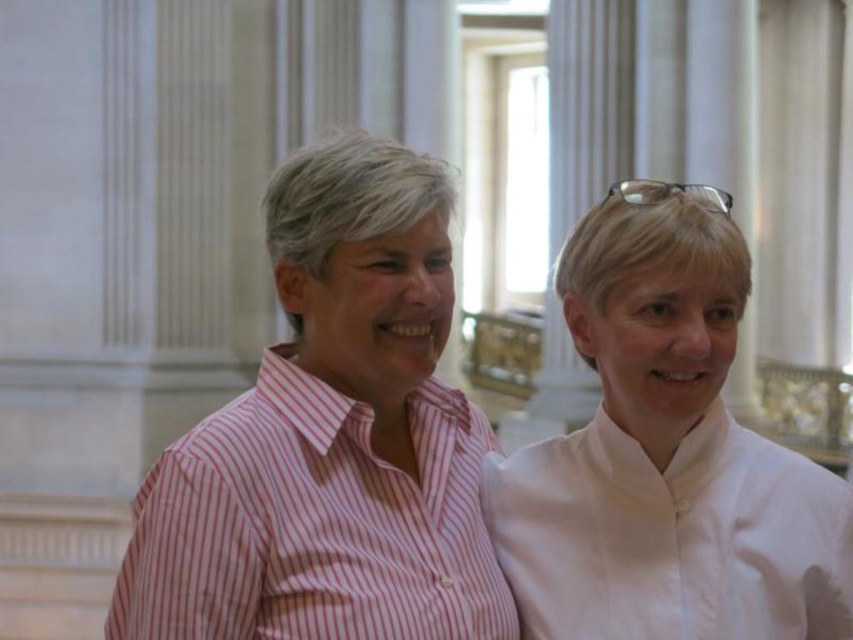
You are a photographer standing 10 feet away from the two people wearing pink striped shirts. You want to take a photo of both of them in the same frame. Given that your camera has a maximum focus range of 10 feet, will both the pink striped shirt at center and the pink striped shirt at left be in focus?

Both the pink striped shirt at center and the pink striped shirt at left are within the 10 feet focus range since they are only 4.43 feet apart from each other. Therefore, they will both be in focus in the photo.